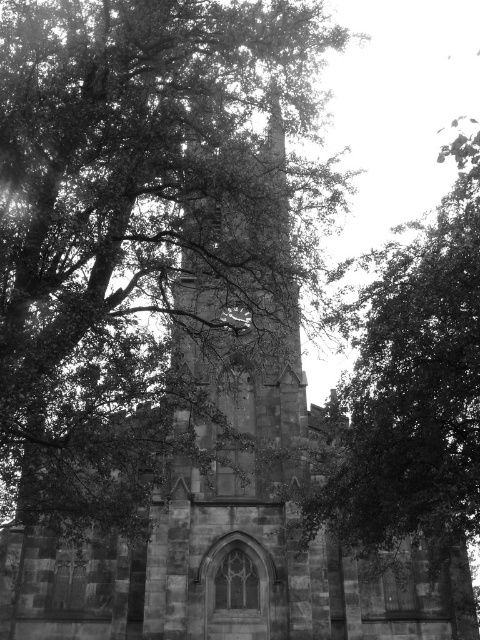
Question: Which point appears farthest from the camera in this image?

Choices:
 (A) (244, 307)
 (B) (188, 440)
 (C) (365, 460)

Answer: (A)

Question: Is dark green leafy tree at center behind metallic gray clock at center?

Choices:
 (A) no
 (B) yes

Answer: (A)

Question: Which point is farther from the camera taking this photo?

Choices:
 (A) (428, 388)
 (B) (195, 232)

Answer: (B)

Question: Among these points, which one is nearest to the camera?

Choices:
 (A) (219, 259)
 (B) (231, 326)

Answer: (A)

Question: Is stone clock tower at center behind metallic gray clock at center?

Choices:
 (A) yes
 (B) no

Answer: (B)

Question: From the image, what is the correct spatial relationship of dark green leafy tree at center in relation to stone clock tower at center?

Choices:
 (A) below
 (B) above

Answer: (A)